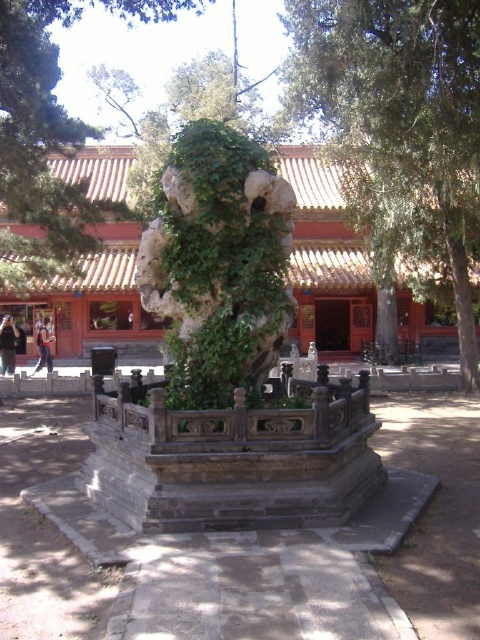
Between green leafy tree at center and green ivy-covered rock at center, which one has less height?

Standing shorter between the two is green leafy tree at center.

Does green leafy tree at center have a lesser width compared to green ivy-covered rock at center?

Yes, green leafy tree at center is thinner than green ivy-covered rock at center.

Is point (394, 61) positioned after point (12, 172)?

No, (394, 61) is closer to viewer.

The height and width of the screenshot is (640, 480). Find the location of `green leafy tree at center`. green leafy tree at center is located at coordinates (400, 128).

Can you confirm if green leafy tree at center is positioned to the right of green mossy stone statue at center?

Yes, green leafy tree at center is to the right of green mossy stone statue at center.

Between green leafy tree at center and green mossy stone statue at center, which one has less height?

green mossy stone statue at center is shorter.

Which is behind, point (375, 230) or point (260, 152)?

Positioned behind is point (375, 230).

Where is `green leafy tree at center`? The height and width of the screenshot is (640, 480). green leafy tree at center is located at coordinates (400, 128).

Is green leafy tree at center below denim jacket at lower left?

Actually, green leafy tree at center is above denim jacket at lower left.

Is point (415, 88) in front of point (43, 362)?

That is True.

At what (x,y) coordinates should I click in order to perform the action: click on green leafy tree at center. Please return your answer as a coordinate pair (x, y). Looking at the image, I should click on (400, 128).